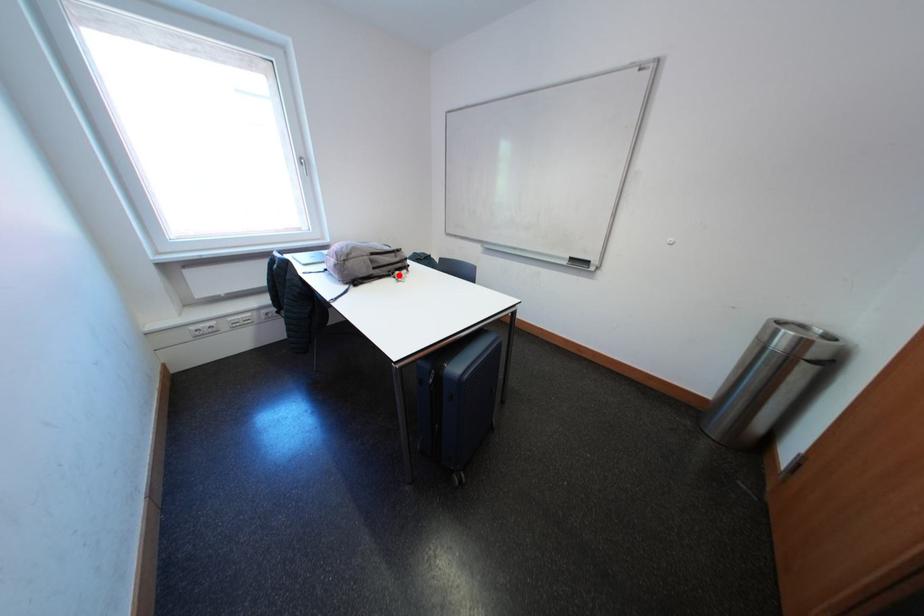
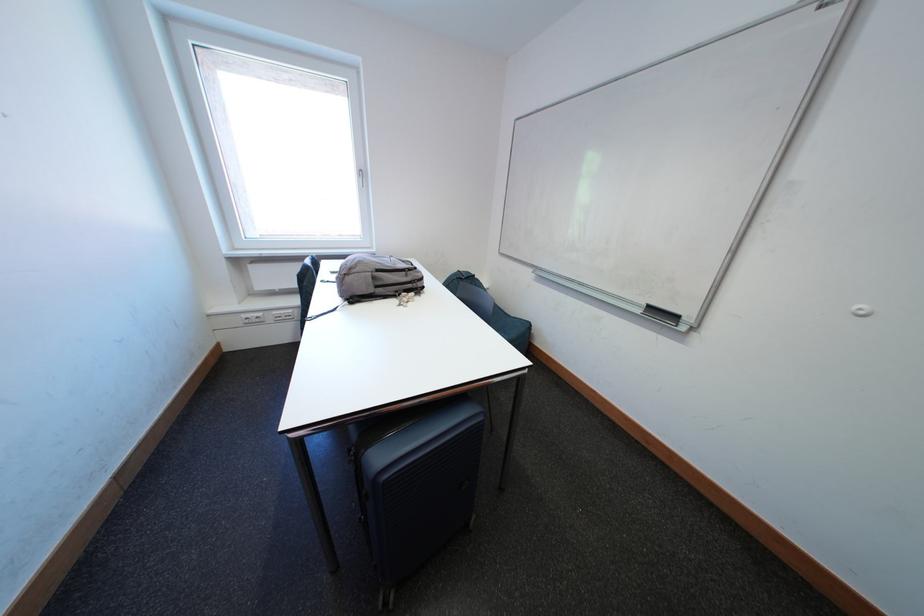
The point at the highlighted location is marked in the first image. Where is the corresponding point in the second image?

(406, 294)